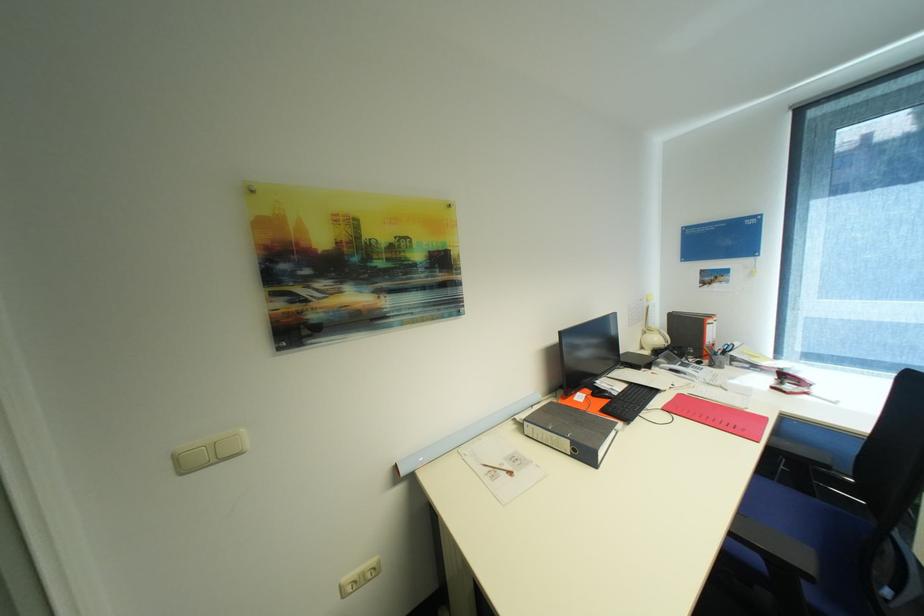
Where would you lift the white phone handset? Please return your answer as a coordinate pair (x, y).

(651, 331)